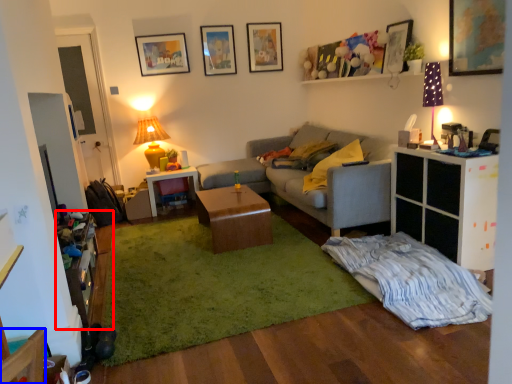
Question: Among these objects, which one is farthest to the camera, dresser (highlighted by a red box) or armchair (highlighted by a blue box)?

Choices:
 (A) dresser
 (B) armchair

Answer: (A)